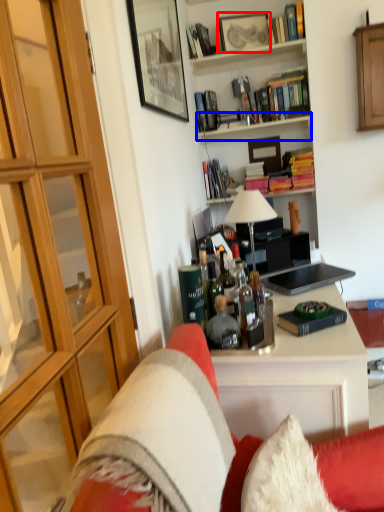
Question: Among these objects, which one is farthest to the camera, picture frame (highlighted by a red box) or shelf (highlighted by a blue box)?

Choices:
 (A) picture frame
 (B) shelf

Answer: (A)